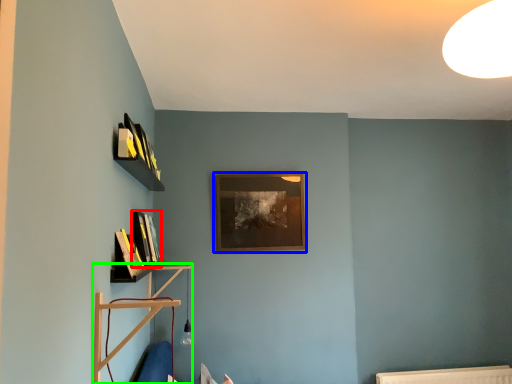
Question: Which object is the closest to the book (highlighted by a red box)? Choose among these: picture frame (highlighted by a blue box) or shelf (highlighted by a green box).

Choices:
 (A) picture frame
 (B) shelf

Answer: (B)